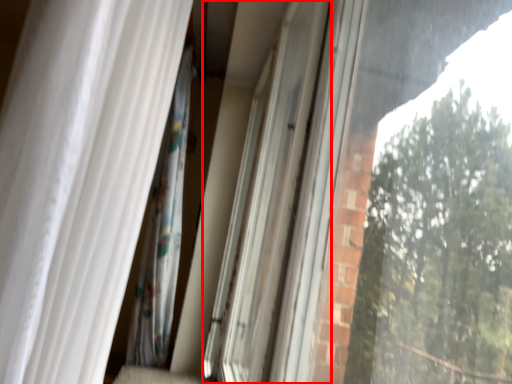
Question: From the image's perspective, where is screen door (annotated by the red box) located relative to curtain?

Choices:
 (A) above
 (B) below

Answer: (B)